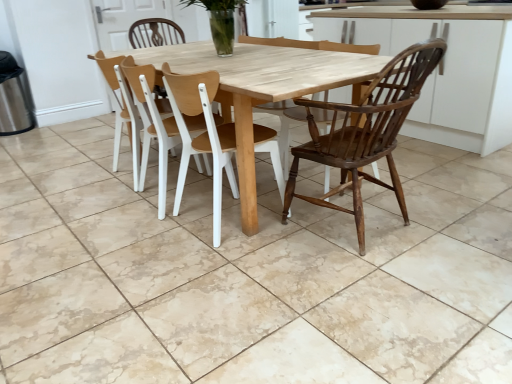
Question: Is dark brown wood chair at right, marked as the third chair in a left-to-right arrangement, spatially inside clear glass vase at center, or outside of it?

Choices:
 (A) outside
 (B) inside

Answer: (A)

Question: Is point (423, 54) positioned closer to the camera than point (222, 8)?

Choices:
 (A) farther
 (B) closer

Answer: (B)

Question: Estimate the real-world distances between objects in this image. Which object is closer to the dark brown wood chair at right, marked as the third chair in a left-to-right arrangement?

Choices:
 (A) wooden chair at center, the 2th chair from the right
 (B) clear glass vase at center
 (C) wooden at center, which ranks as the third chair in right-to-left order
 (D) wooden chair at right
 (E) light wood table at center

Answer: (E)

Question: Estimate the real-world distances between objects in this image. Which object is closer to the wooden chair at center, which is the 2th chair in left-to-right order?

Choices:
 (A) natural stone tile at center
 (B) wooden chair at right
 (C) dark brown wood chair at right, the first chair in the right-to-left sequence
 (D) clear glass vase at center
 (E) light wood table at center

Answer: (E)